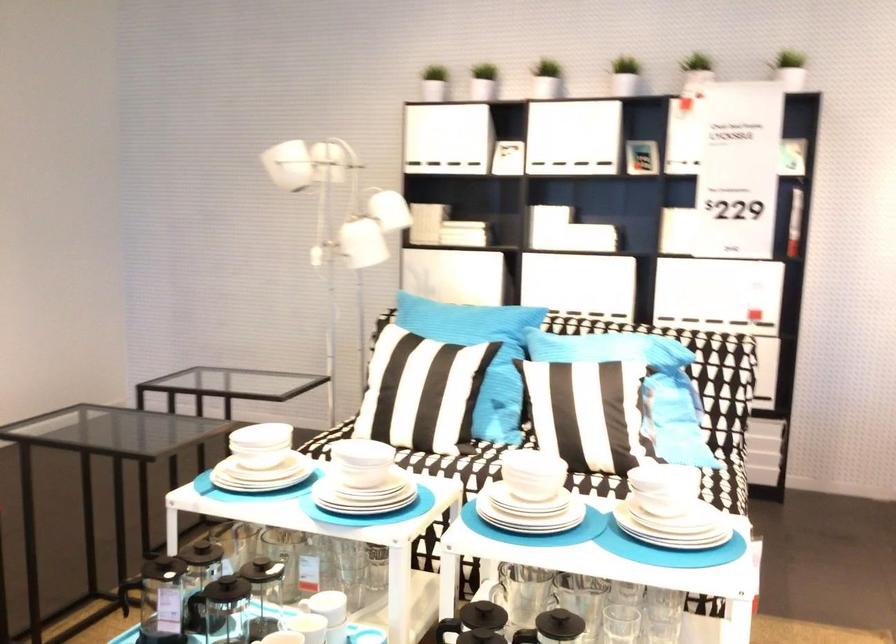
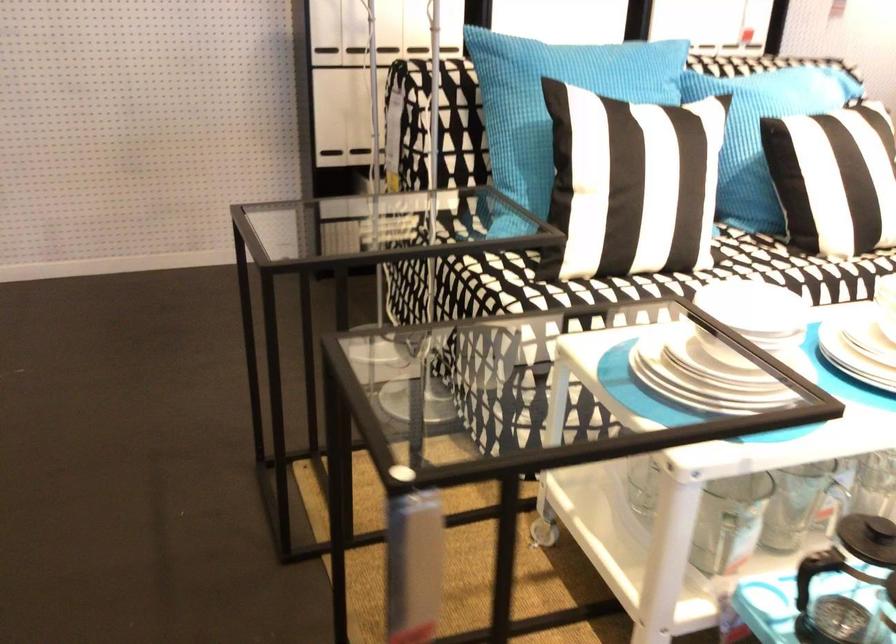
Where in the second image is the point corresponding to point (401, 285) from the first image?

(325, 46)